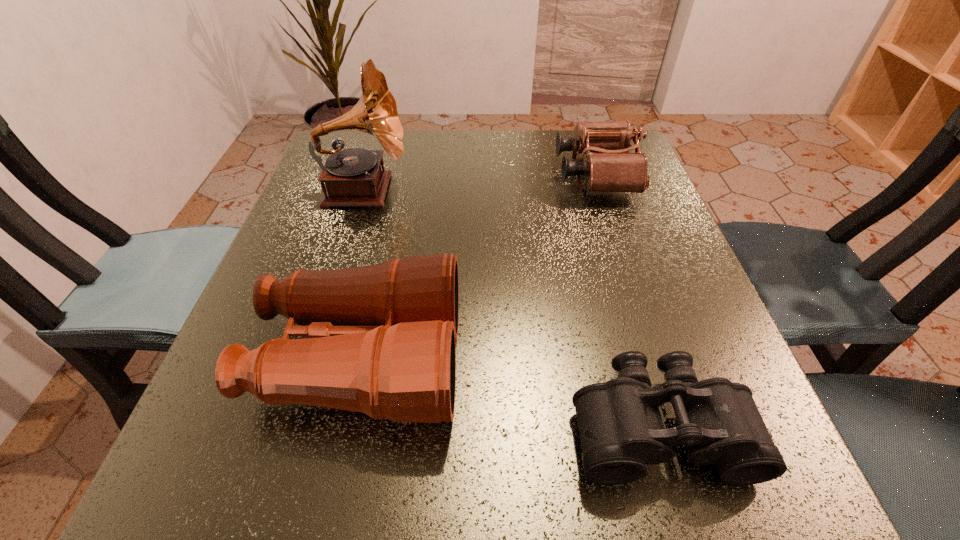
Locate an element on the screen. vacant space located through the eyepieces of the second tallest binoculars is located at coordinates (461, 174).

Image resolution: width=960 pixels, height=540 pixels. I want to click on phonograph_record that is positioned at the far edge, so click(x=353, y=177).

The height and width of the screenshot is (540, 960). I want to click on binoculars present at the far edge, so click(608, 166).

At what (x,y) coordinates should I click in order to perform the action: click on phonograph_record that is positioned at the left edge. Please return your answer as a coordinate pair (x, y). The width and height of the screenshot is (960, 540). Looking at the image, I should click on (353, 177).

You are a GUI agent. You are given a task and a screenshot of the screen. Output one action in this format:
    pyautogui.click(x=<x>, y=<y>)
    Task: Click on the binoculars that is at the left edge
    The height and width of the screenshot is (540, 960).
    Given the screenshot: What is the action you would take?
    pyautogui.click(x=381, y=341)

I want to click on object that is at the far left corner, so click(x=353, y=177).

Find the location of `object that is at the near left corner`. object that is at the near left corner is located at coordinates (381, 341).

This screenshot has width=960, height=540. Identify the location of object present at the far right corner. (608, 166).

At what (x,y) coordinates should I click in order to perform the action: click on object located at the near right corner. Please return your answer as a coordinate pair (x, y). Looking at the image, I should click on (621, 431).

The height and width of the screenshot is (540, 960). Identify the location of vacant space at the far edge of the desktop. (409, 151).